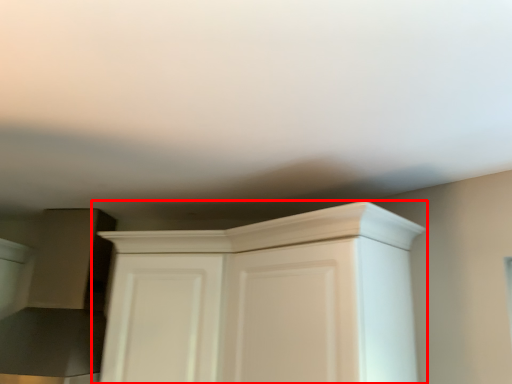
Question: In this image, where is cupboard (annotated by the red box) located relative to door?

Choices:
 (A) left
 (B) right

Answer: (B)